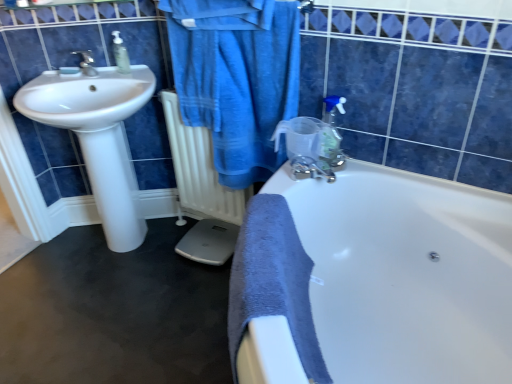
Question: Considering the relative sizes of blue cotton bathrobe at upper center and translucent plastic soap dispenser at upper right, the 2th soap dispenser when ordered from top to bottom, in the image provided, is blue cotton bathrobe at upper center bigger than translucent plastic soap dispenser at upper right, the 2th soap dispenser when ordered from top to bottom,?

Choices:
 (A) no
 (B) yes

Answer: (B)

Question: Is blue cotton bathrobe at upper center far away from translucent plastic soap dispenser at upper right, the 1th soap dispenser from the front?

Choices:
 (A) yes
 (B) no

Answer: (B)

Question: Considering the relative positions of blue cotton bathrobe at upper center and translucent plastic soap dispenser at upper right, the first soap dispenser positioned from the bottom, in the image provided, is blue cotton bathrobe at upper center to the left of translucent plastic soap dispenser at upper right, the first soap dispenser positioned from the bottom, from the viewer's perspective?

Choices:
 (A) no
 (B) yes

Answer: (B)

Question: From the image's perspective, is blue cotton bathrobe at upper center above translucent plastic soap dispenser at upper right, the first soap dispenser positioned from the bottom?

Choices:
 (A) yes
 (B) no

Answer: (A)

Question: Does blue cotton bathrobe at upper center have a lesser height compared to translucent plastic soap dispenser at upper right, which is the 2th soap dispenser from left to right?

Choices:
 (A) yes
 (B) no

Answer: (B)

Question: Do you think white glossy sink at left is within blue cotton bathrobe at upper center, or outside of it?

Choices:
 (A) inside
 (B) outside

Answer: (B)

Question: Relative to blue cotton bathrobe at upper center, is white glossy sink at left in front or behind?

Choices:
 (A) front
 (B) behind

Answer: (B)

Question: From the image's perspective, relative to blue cotton bathrobe at upper center, is white glossy sink at left above or below?

Choices:
 (A) below
 (B) above

Answer: (A)

Question: In the image, is white glossy sink at left on the left side or the right side of blue cotton bathrobe at upper center?

Choices:
 (A) right
 (B) left

Answer: (B)

Question: Is blue cotton bathrobe at upper center situated inside white glossy bathtub at center or outside?

Choices:
 (A) outside
 (B) inside

Answer: (A)

Question: Visually, is blue cotton bathrobe at upper center positioned to the left or to the right of white glossy bathtub at center?

Choices:
 (A) right
 (B) left

Answer: (B)

Question: From the image's perspective, is blue cotton bathrobe at upper center located above or below white glossy bathtub at center?

Choices:
 (A) below
 (B) above

Answer: (B)

Question: From their relative heights in the image, would you say blue cotton bathrobe at upper center is taller or shorter than white glossy bathtub at center?

Choices:
 (A) tall
 (B) short

Answer: (A)

Question: Is point (164, 99) closer or farther from the camera than point (117, 67)?

Choices:
 (A) closer
 (B) farther

Answer: (B)

Question: From their relative heights in the image, would you say white matte radiator at center is taller or shorter than clear plastic soap dispenser at upper left, the 2th soap dispenser positioned from the front?

Choices:
 (A) tall
 (B) short

Answer: (A)